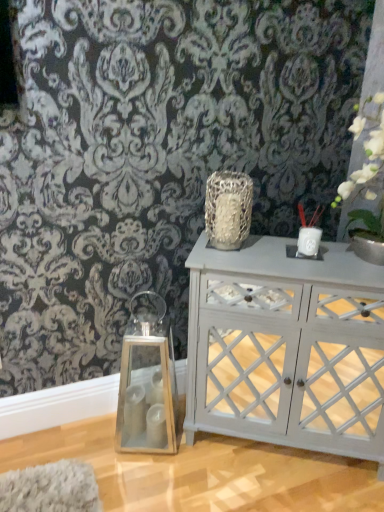
The image size is (384, 512). Identify the location of vacant region to the right of white ceramic candle holder at upper right, arranged as the second candle holder when viewed from the left. (342, 260).